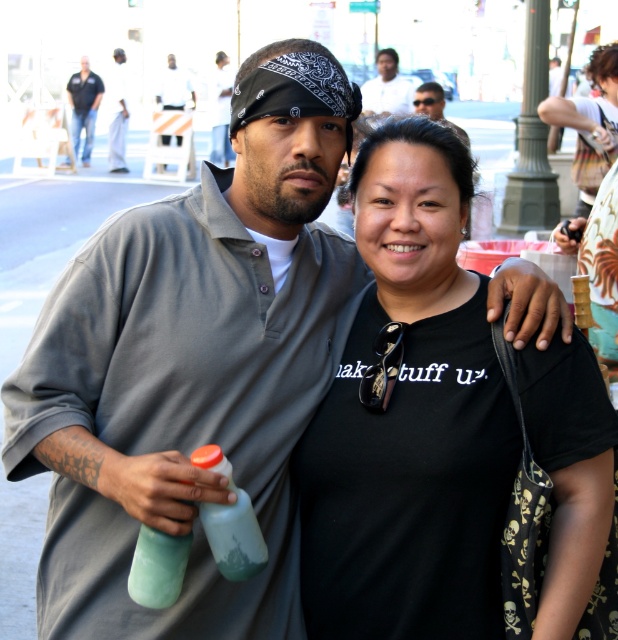
Who is positioned more to the left, black matte t-shirt at center or dark blue shirt at center?

From the viewer's perspective, dark blue shirt at center appears more on the left side.

At what (x,y) coordinates should I click in order to perform the action: click on black matte t-shirt at center. Please return your answer as a coordinate pair (x, y). This screenshot has height=640, width=618. Looking at the image, I should click on (408, 417).

Can you confirm if dark blue shirt at center is shorter than matte black bandana at center?

Yes, dark blue shirt at center is shorter than matte black bandana at center.

Can you confirm if dark blue shirt at center is positioned to the left of matte black bandana at center?

Yes, dark blue shirt at center is to the left of matte black bandana at center.

Who is more forward, (93, 100) or (227, 77)?

Point (93, 100) is in front.

Identify the location of dark blue shirt at center. (83, 106).

Is white cotton shirt at upper center wider than matte gray shirt at center?

Indeed, white cotton shirt at upper center has a greater width compared to matte gray shirt at center.

Does white cotton shirt at upper center appear on the right side of matte gray shirt at center?

In fact, white cotton shirt at upper center is to the left of matte gray shirt at center.

The image size is (618, 640). What are the coordinates of `white cotton shirt at upper center` in the screenshot? It's located at (116, 113).